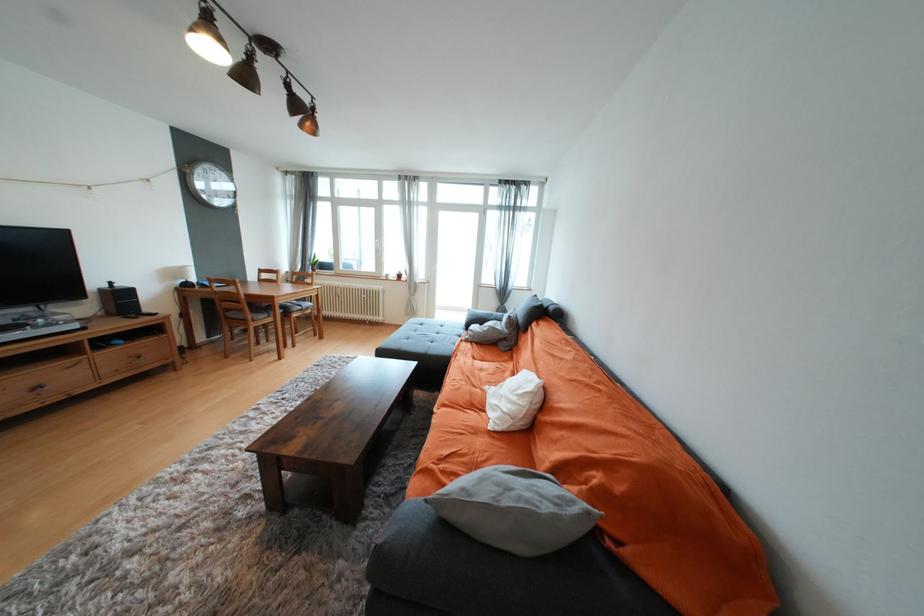
Where would you lift the white pillow? Please return your answer as a coordinate pair (x, y).

(514, 402)